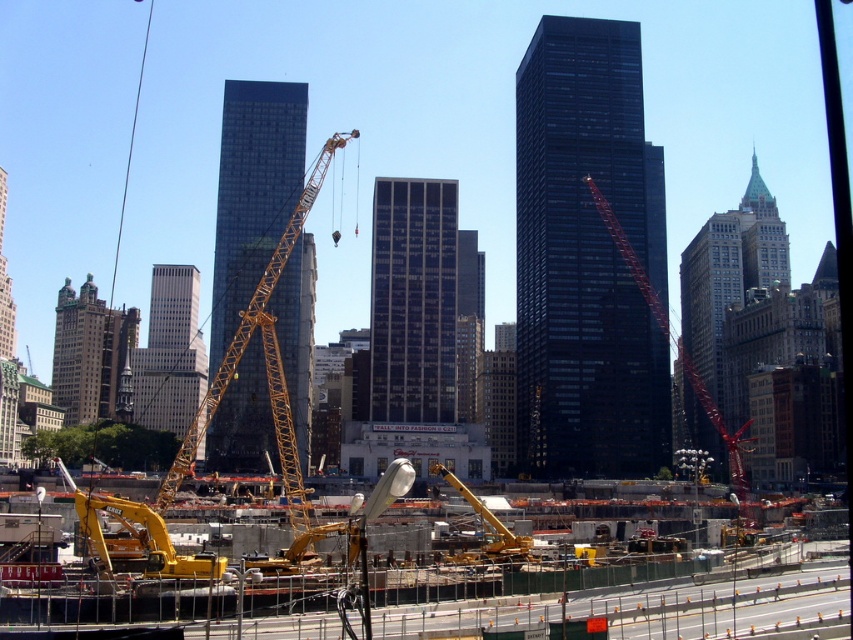
Does yellow metallic excavator at lower center have a greater height compared to yellow metallic crane at center?

No.

Where is `yellow metallic excavator at lower center`? The height and width of the screenshot is (640, 853). yellow metallic excavator at lower center is located at coordinates (184, 609).

The height and width of the screenshot is (640, 853). Find the location of `yellow metallic excavator at lower center`. yellow metallic excavator at lower center is located at coordinates (184, 609).